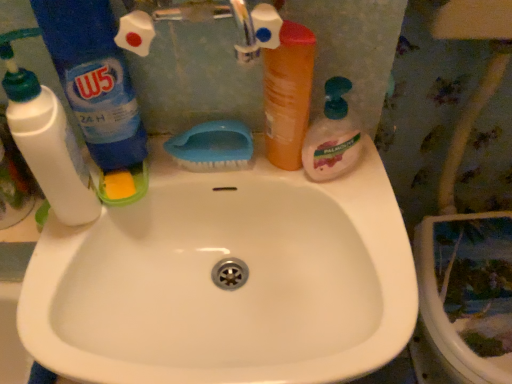
Question: Considering their positions, is blue plastic bottle at left, the second cleaning product positioned from the left, located in front of or behind blue plastic brush at upper center?

Choices:
 (A) front
 (B) behind

Answer: (A)

Question: Is point (121, 140) closer or farther from the camera than point (205, 130)?

Choices:
 (A) farther
 (B) closer

Answer: (B)

Question: Which is nearer to the white plastic bottle at left, placed as the 3th cleaning product when sorted from right to left?

Choices:
 (A) blue plastic bottle at left, the second cleaning product positioned from the left
 (B) blue plastic brush at upper center
 (C) orange matte bottle at upper center
 (D) translucent plastic soap dispenser at right, which ranks as the third cleaning product in left-to-right order

Answer: (A)

Question: Which is farther from the orange matte bottle at upper center?

Choices:
 (A) white plastic bottle at left, placed as the 3th cleaning product when sorted from right to left
 (B) blue plastic brush at upper center
 (C) translucent plastic soap dispenser at right, which ranks as the third cleaning product in left-to-right order
 (D) blue plastic bottle at left, which is counted as the second cleaning product, starting from the right

Answer: (A)